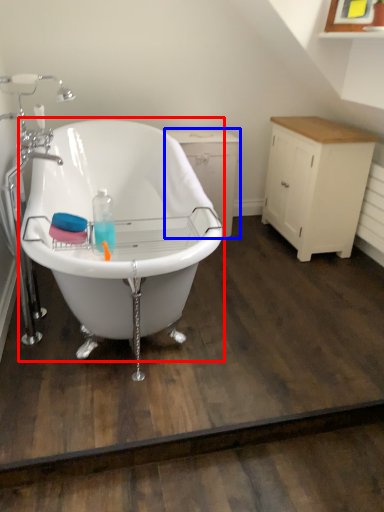
Question: Which object appears farthest to the camera in this image, bathtub (highlighted by a red box) or dresser (highlighted by a blue box)?

Choices:
 (A) bathtub
 (B) dresser

Answer: (B)